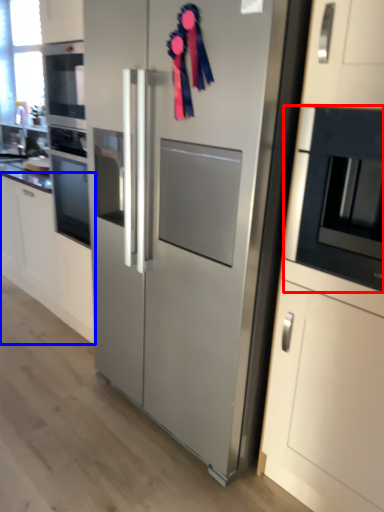
Question: Which of the following is the farthest to the observer, microwave oven (highlighted by a red box) or cabinetry (highlighted by a blue box)?

Choices:
 (A) microwave oven
 (B) cabinetry

Answer: (B)